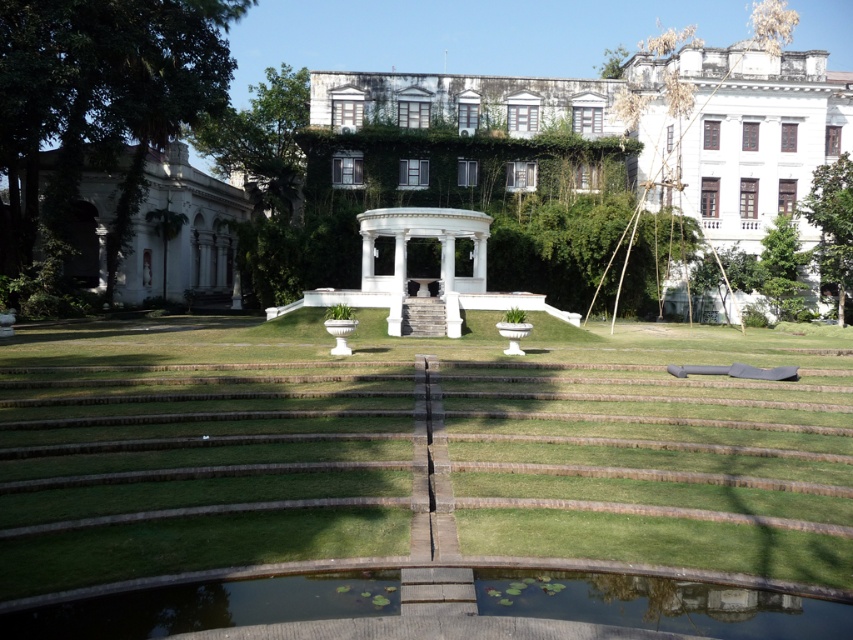
Question: Which object is positioned farthest from the green smooth water at lower center?

Choices:
 (A) green grass at center
 (B) white marble gazebo at center
 (C) white marble mansion at left

Answer: (C)

Question: Which is farther from the white marble mansion at left?

Choices:
 (A) green grass at center
 (B) green smooth water at lower center
 (C) white marble gazebo at center

Answer: (B)

Question: Can you confirm if green smooth water at lower center is positioned to the right of white marble mansion at left?

Choices:
 (A) yes
 (B) no

Answer: (A)

Question: Does green grass at center appear on the left side of white marble gazebo at center?

Choices:
 (A) no
 (B) yes

Answer: (A)

Question: Does green smooth water at lower center appear on the right side of white marble mansion at left?

Choices:
 (A) yes
 (B) no

Answer: (A)

Question: Which point is closer to the camera?

Choices:
 (A) white marble gazebo at center
 (B) green grass at center
 (C) green smooth water at lower center
 (D) white marble mansion at left

Answer: (C)